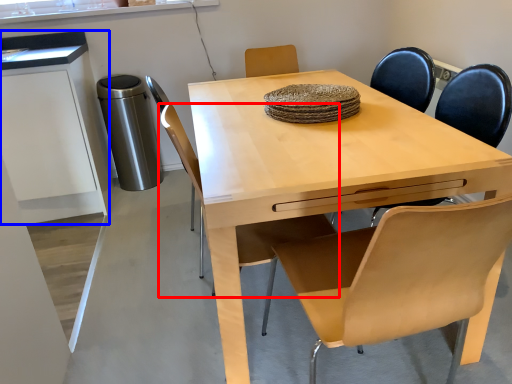
Question: Among these objects, which one is farthest to the camera, chair (highlighted by a red box) or cabinetry (highlighted by a blue box)?

Choices:
 (A) chair
 (B) cabinetry

Answer: (B)